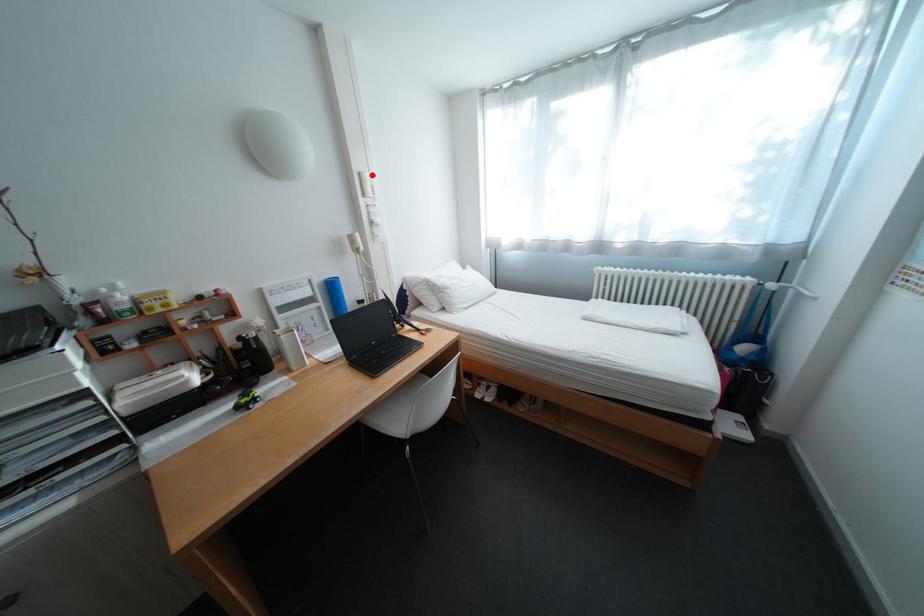
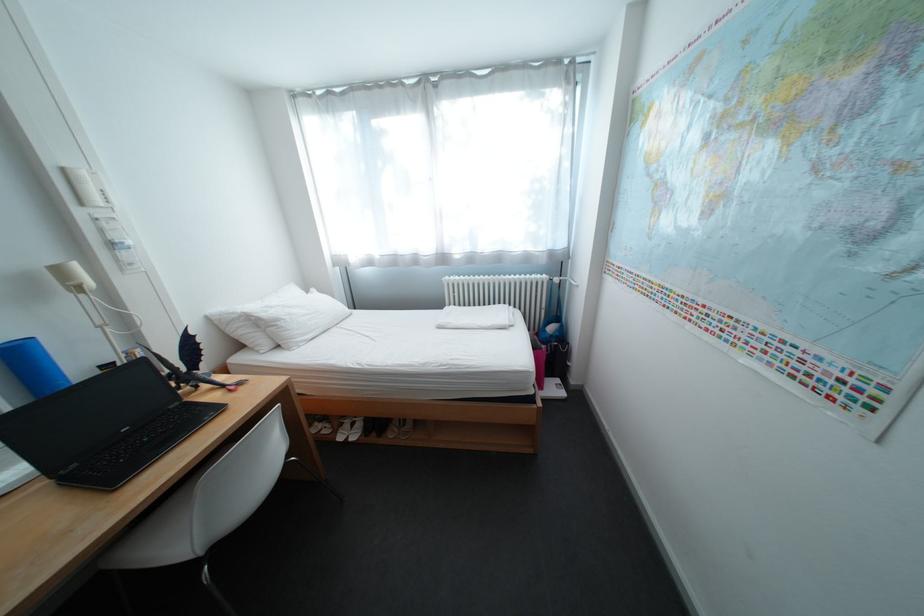
Question: I am providing you with two images of the same scene from different viewpoints. A red point is shown in image1. For the corresponding object point in image2, is it positioned nearer or farther from the camera?

Choices:
 (A) Nearer
 (B) Farther

Answer: (B)